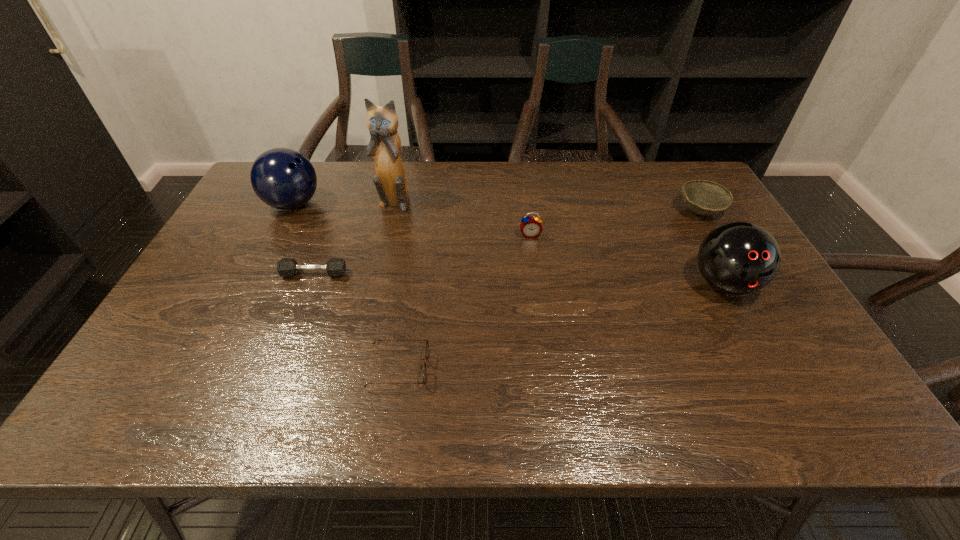
Locate an element on the screen. The height and width of the screenshot is (540, 960). blank space located 0.060m on the surface of the farther bowling ball near the finger holes is located at coordinates (342, 204).

Find the location of `free spot located 0.160m on the surface of the right bowling ball near the finger holes`. free spot located 0.160m on the surface of the right bowling ball near the finger holes is located at coordinates (768, 364).

Locate an element on the screen. vacant space located on the front-facing side of the alarm clock is located at coordinates (540, 309).

Find the location of a particular element. The height and width of the screenshot is (540, 960). vacant area located 0.300m on the front of the bowl is located at coordinates (751, 299).

Where is `vacant space located on the front of the second shortest object`? The width and height of the screenshot is (960, 540). vacant space located on the front of the second shortest object is located at coordinates (302, 305).

Identify the location of vacant space located 0.260m on the front-facing side of the nearest object. (544, 368).

This screenshot has width=960, height=540. Identify the location of cat located at the far edge. (390, 181).

Where is `bowling ball that is at the far edge`? bowling ball that is at the far edge is located at coordinates (283, 178).

Locate an element on the screen. The width and height of the screenshot is (960, 540). bowl at the far edge is located at coordinates (703, 197).

At what (x,y) coordinates should I click in order to perform the action: click on object at the near edge. Please return your answer as a coordinate pair (x, y). Looking at the image, I should click on (427, 345).